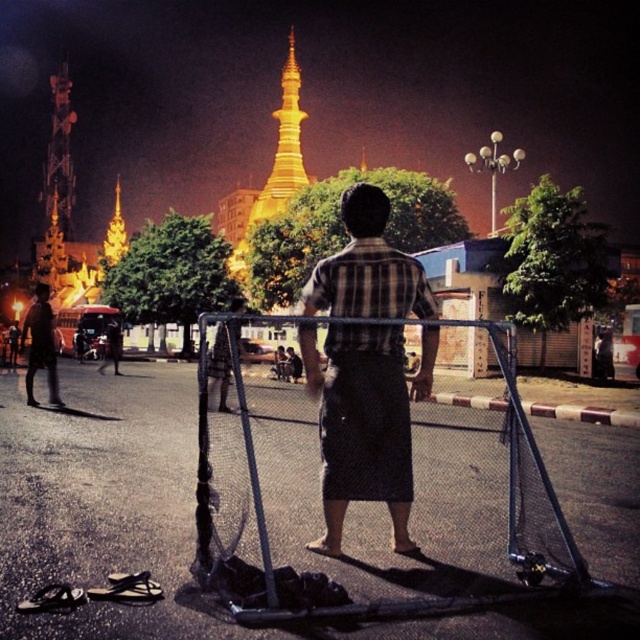
Is point (200, 422) positioned in front of point (28, 381)?

Yes.

Looking at this image, is metallic wire fence at center thinner than dark gray pants at lower left?

No, metallic wire fence at center is not thinner than dark gray pants at lower left.

Is point (289, 499) positioned after point (35, 284)?

That is False.

Where is `metallic wire fence at center`? The width and height of the screenshot is (640, 640). metallic wire fence at center is located at coordinates (372, 500).

Between metallic wire fence at center and plaid fabric shirt at center, which one has more height?

With more height is plaid fabric shirt at center.

Can you confirm if metallic wire fence at center is shorter than plaid fabric shirt at center?

Yes, metallic wire fence at center is shorter than plaid fabric shirt at center.

I want to click on metallic wire fence at center, so click(x=372, y=500).

Which of these two, plaid fabric shirt at center or dark gray pants at lower left, stands shorter?

Standing shorter between the two is dark gray pants at lower left.

Consider the image. Between plaid fabric shirt at center and dark gray pants at lower left, which one is positioned higher?

dark gray pants at lower left

Find the location of a particular element. This screenshot has height=640, width=640. plaid fabric shirt at center is located at coordinates (362, 426).